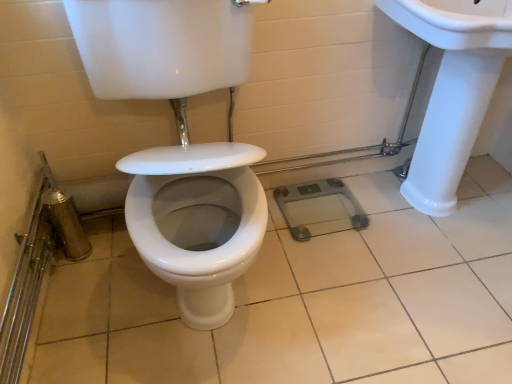
The height and width of the screenshot is (384, 512). Find the location of `free space below white glossy sink at upper right (from a real-world perspective)`. free space below white glossy sink at upper right (from a real-world perspective) is located at coordinates (424, 213).